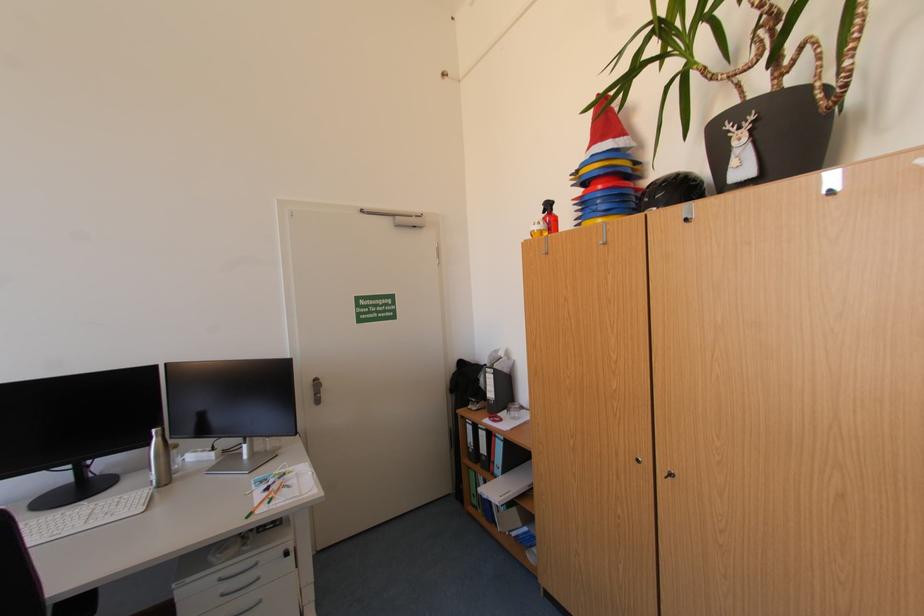
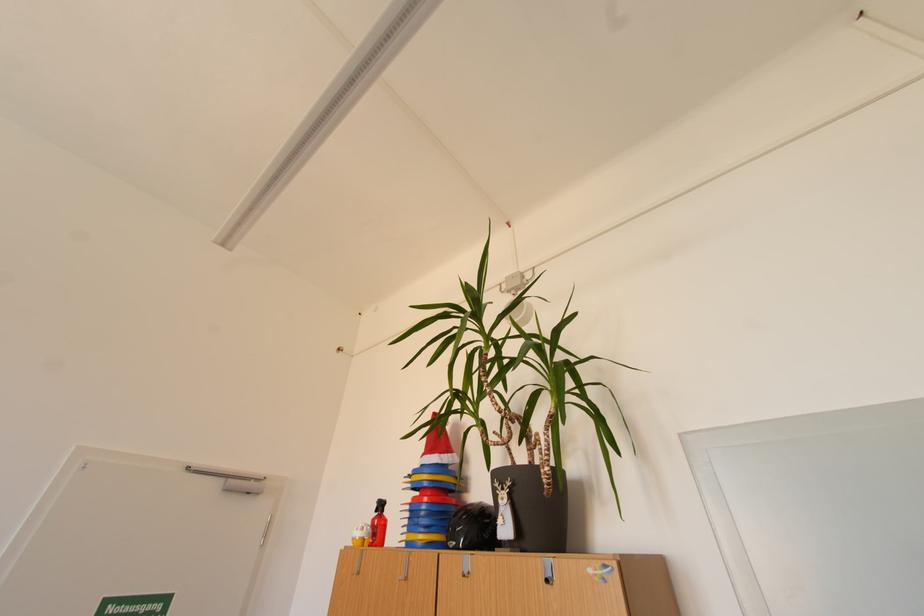
The point at (760, 119) is marked in the first image. Where is the corresponding point in the second image?

(517, 485)